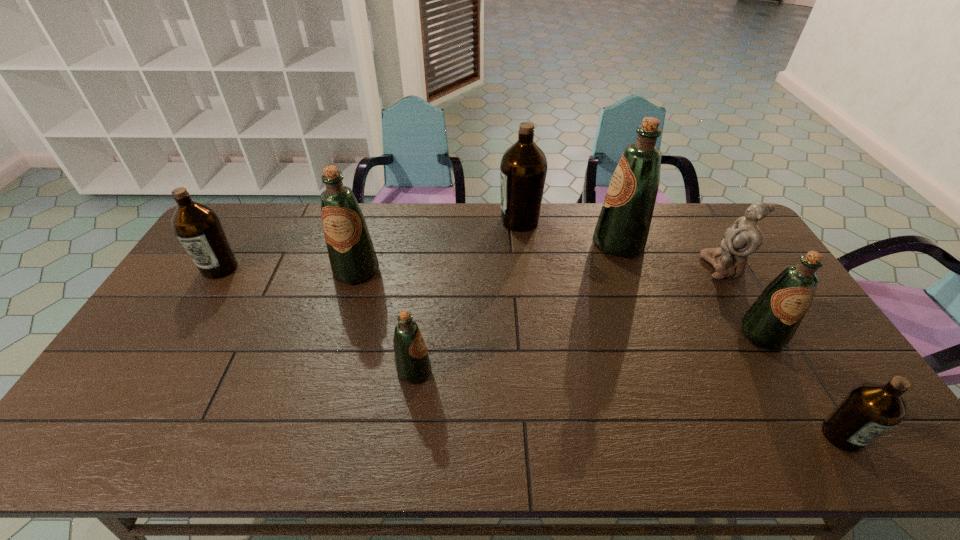
This screenshot has height=540, width=960. I want to click on vacant position in the image that satisfies the following two spatial constraints: 1. on the front-facing side of the figurine; 2. on the front-facing side of the rightmost green olive oil, so click(x=764, y=335).